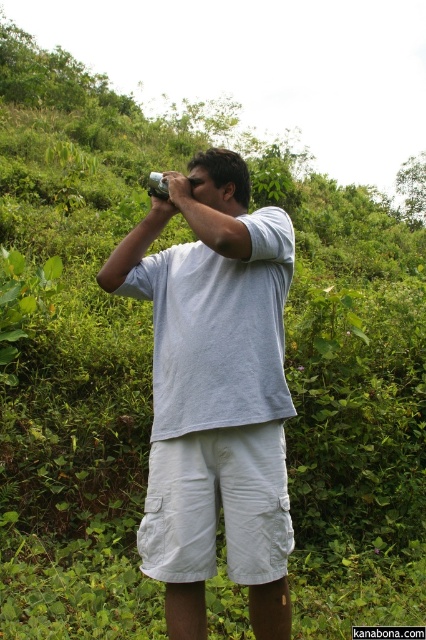
Question: Which point appears farthest from the camera in this image?

Choices:
 (A) (256, 492)
 (B) (198, 349)

Answer: (B)

Question: Can you confirm if white cotton shirt at center is thinner than white cotton shorts at center?

Choices:
 (A) no
 (B) yes

Answer: (A)

Question: Can you confirm if white cotton shirt at center is thinner than white cotton shorts at center?

Choices:
 (A) no
 (B) yes

Answer: (A)

Question: Which point is farther to the camera?

Choices:
 (A) 152,484
 (B) 189,257

Answer: (B)

Question: In this image, where is white cotton shirt at center located relative to white cotton shorts at center?

Choices:
 (A) above
 (B) below

Answer: (A)